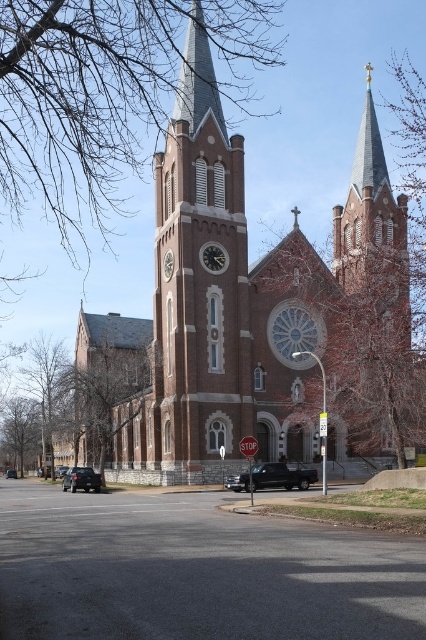
You are standing in front of the historic church and notice two clocks on the main tower. The matte black clock at center and the gold metallic clock at center. Which one is taller?

The gold metallic clock at center is taller than the matte black clock at center.

You are standing in front of the historic church and want to locate two specific points marked on the facade. The first point is at coordinate point (178, 396) and the second is at point (58, 472). Which of these two points is positioned closer to your current viewpoint?

Point (178, 396) is closer to the viewer than point (58, 472).